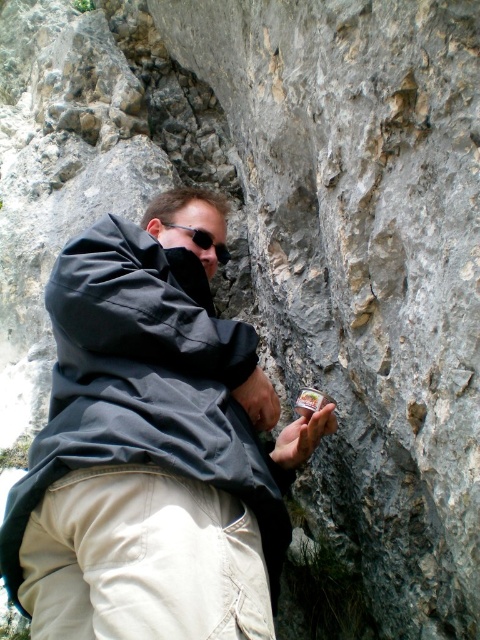
The man in the image is wearing a dark jacket and light pants. Where is the dark gray fabric at center located in relation to the man?

The dark gray fabric at center is located at point 0.700 in the x coordinate and 0.319 in the y coordinate relative to the man.

You are a photographer trying to capture the man in the scene. You need to ensure both the khaki cotton pants at lower left and the black matte sunglasses at center are clearly visible in your photo. Which object should you focus on first to ensure both are in focus?

The khaki cotton pants at lower left is much taller than the black matte sunglasses at center. To ensure both are in focus, you should focus on the khaki cotton pants at lower left first since it is taller and closer to the camera, allowing the sunglasses to remain in the depth of field.

You are a photographer trying to capture the man and the rock formation in the image. The man is standing at point (153, 448). You want to ensure the dark gray fabric at center is visible in the background. Is the man positioned in a way that allows the dark gray fabric at center to be visible behind him?

The point (153, 448) where the man is standing is on the dark gray fabric at center, so the dark gray fabric at center is directly under him. This means the dark gray fabric at center would not be visible in the background behind him since he is standing on it.